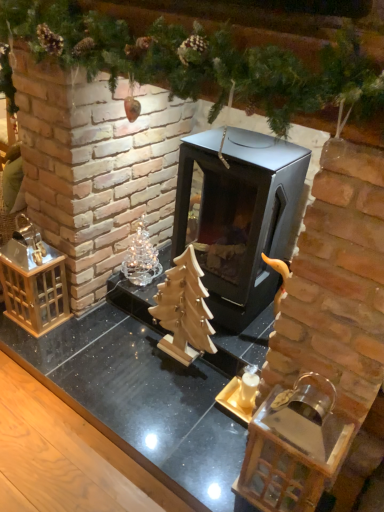
Question: Would you say wooden christmas tree at center is outside clear glass ornament at center left?

Choices:
 (A) no
 (B) yes

Answer: (B)

Question: Is wooden christmas tree at center not close to clear glass ornament at center left?

Choices:
 (A) yes
 (B) no

Answer: (B)

Question: Does wooden christmas tree at center have a lesser height compared to clear glass ornament at center left?

Choices:
 (A) no
 (B) yes

Answer: (A)

Question: Can you confirm if wooden christmas tree at center is positioned to the right of clear glass ornament at center left?

Choices:
 (A) no
 (B) yes

Answer: (B)

Question: Is wooden christmas tree at center taller than clear glass ornament at center left?

Choices:
 (A) yes
 (B) no

Answer: (A)

Question: From a real-world perspective, relative to clear glass ornament at center left, is wooden christmas tree at center vertically above or below?

Choices:
 (A) below
 (B) above

Answer: (A)

Question: From the image's perspective, is wooden christmas tree at center above or below clear glass ornament at center left?

Choices:
 (A) below
 (B) above

Answer: (A)

Question: In terms of width, does wooden christmas tree at center look wider or thinner when compared to clear glass ornament at center left?

Choices:
 (A) thin
 (B) wide

Answer: (A)

Question: Considering their positions, is wooden christmas tree at center located in front of or behind clear glass ornament at center left?

Choices:
 (A) front
 (B) behind

Answer: (A)

Question: Relative to wooden christmas tree at center, is black metal fireplace at center in front or behind?

Choices:
 (A) behind
 (B) front

Answer: (B)

Question: In terms of height, does black metal fireplace at center look taller or shorter compared to wooden christmas tree at center?

Choices:
 (A) tall
 (B) short

Answer: (A)

Question: In terms of size, does black metal fireplace at center appear bigger or smaller than wooden christmas tree at center?

Choices:
 (A) small
 (B) big

Answer: (B)

Question: Is black metal fireplace at center inside or outside of wooden christmas tree at center?

Choices:
 (A) outside
 (B) inside

Answer: (A)

Question: Based on their sizes in the image, would you say black metal fireplace at center is bigger or smaller than clear glass ornament at center left?

Choices:
 (A) small
 (B) big

Answer: (B)

Question: From a real-world perspective, is black metal fireplace at center above or below clear glass ornament at center left?

Choices:
 (A) below
 (B) above

Answer: (B)